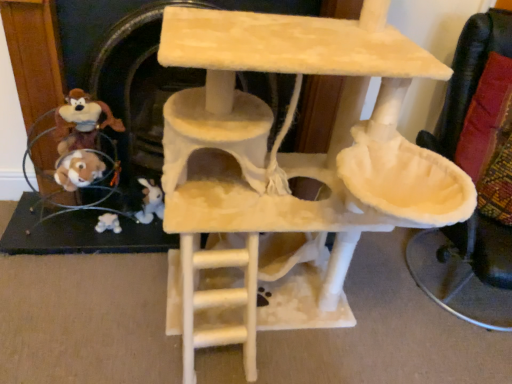
Where is `free point below velvet-like black armchair at right (from a real-world perspective)`? The image size is (512, 384). free point below velvet-like black armchair at right (from a real-world perspective) is located at coordinates (446, 288).